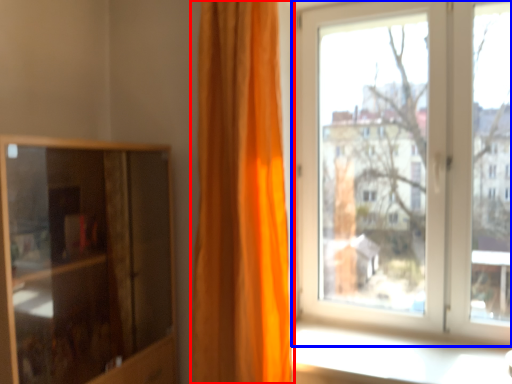
Question: Among these objects, which one is nearest to the camera, curtain (highlighted by a red box) or window (highlighted by a blue box)?

Choices:
 (A) curtain
 (B) window

Answer: (A)